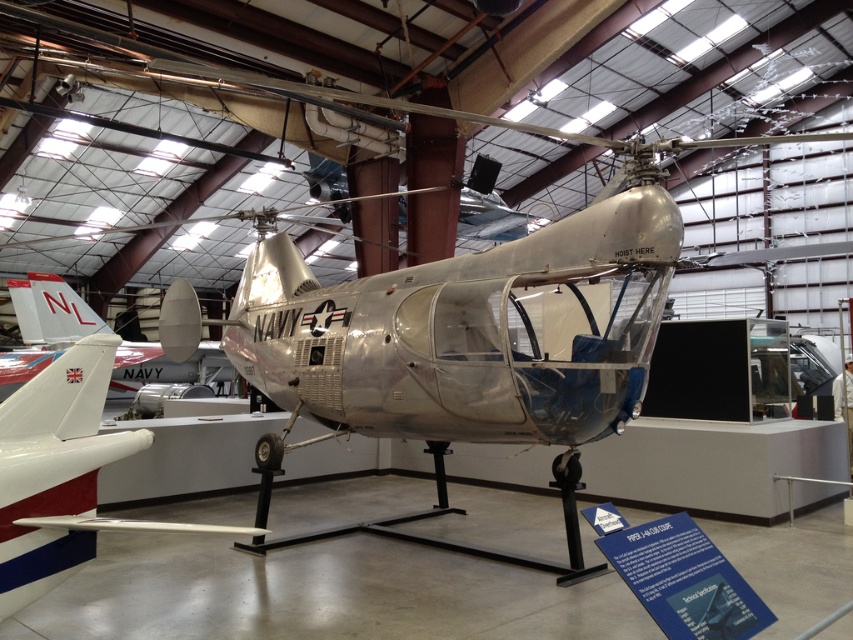
Question: Can you confirm if silver metallic helicopter at center is positioned to the right of silver metallic airplane at center?

Choices:
 (A) no
 (B) yes

Answer: (B)

Question: Can you confirm if silver metallic helicopter at center is positioned to the right of silver metallic airplane at center?

Choices:
 (A) yes
 (B) no

Answer: (A)

Question: Which object appears farthest from the camera in this image?

Choices:
 (A) silver metallic helicopter at center
 (B) silver metallic airplane at center

Answer: (B)

Question: Does silver metallic helicopter at center have a greater width compared to silver metallic airplane at center?

Choices:
 (A) no
 (B) yes

Answer: (A)